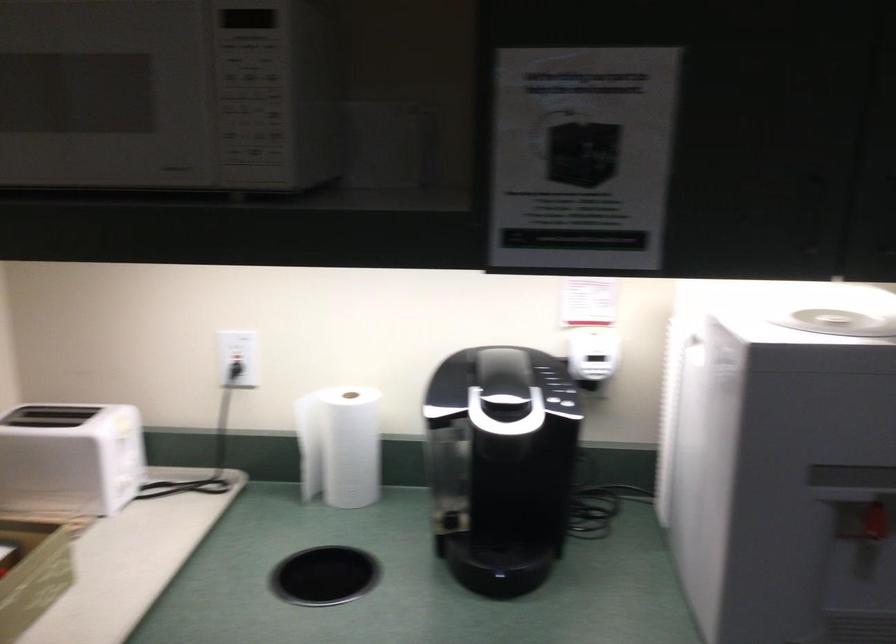
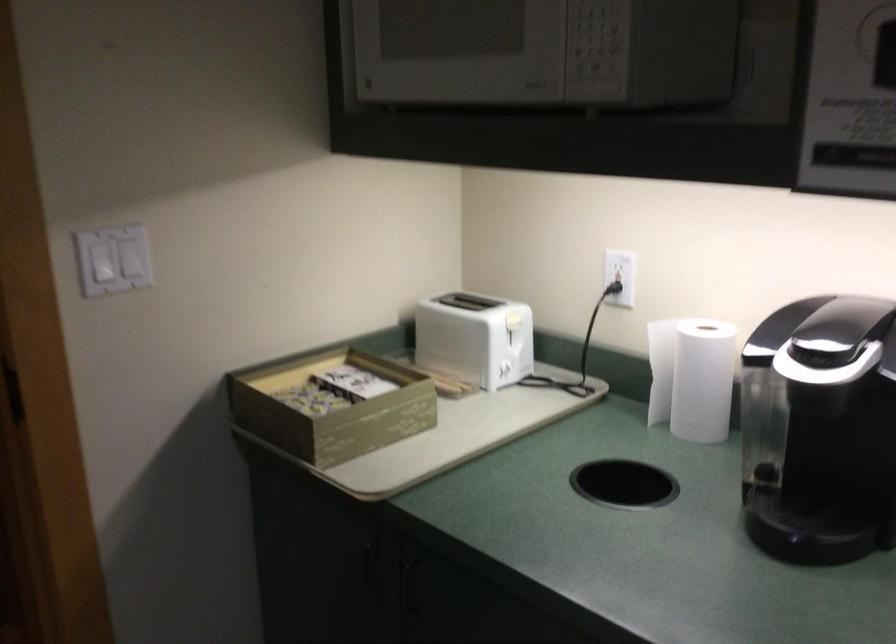
Find the pixel in the second image that matches point (517, 491) in the first image.

(839, 458)